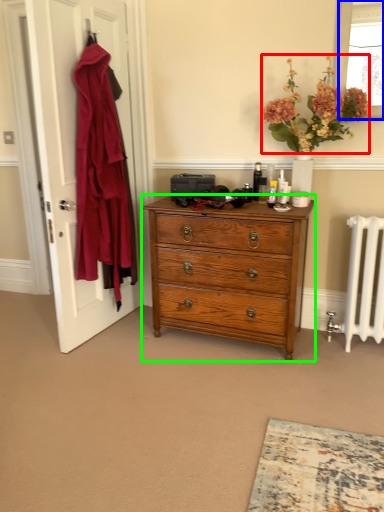
Question: Which object is the farthest from flower (highlighted by a red box)? Choose among these: window screen (highlighted by a blue box) or chest of drawers (highlighted by a green box).

Choices:
 (A) window screen
 (B) chest of drawers

Answer: (B)